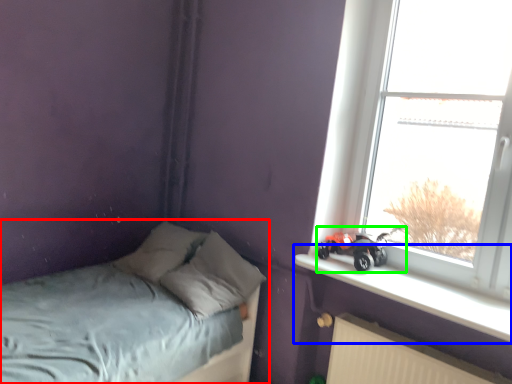
Question: Which object is the closest to the bed (highlighted by a red box)? Choose among these: window sill (highlighted by a blue box) or land vehicle (highlighted by a green box).

Choices:
 (A) window sill
 (B) land vehicle

Answer: (A)